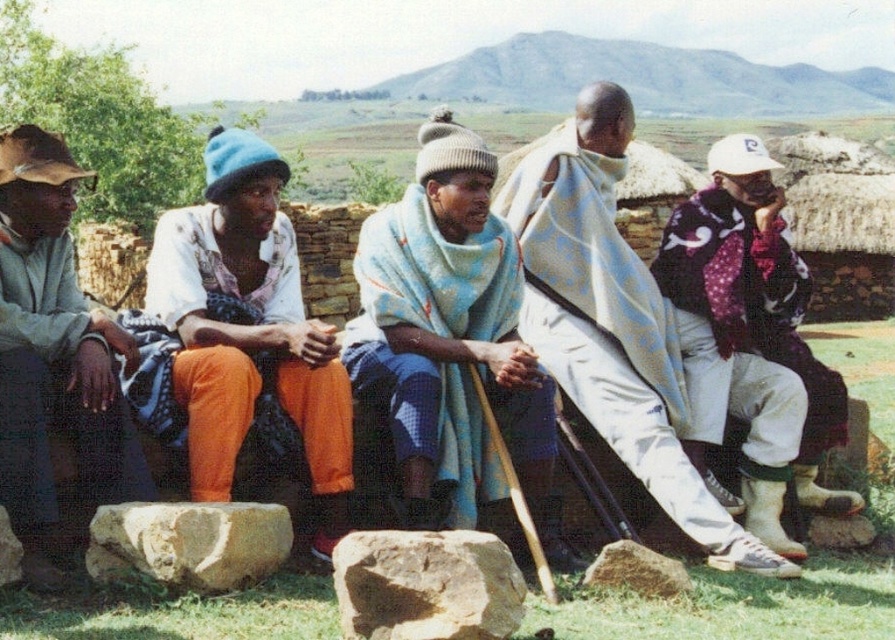
Is point (445, 547) closer to viewer compared to point (284, 554)?

Yes, point (445, 547) is in front of point (284, 554).

Does brown rough rock at lower center appear on the left side of smooth beige rock at lower left?

In fact, brown rough rock at lower center is to the right of smooth beige rock at lower left.

Between point (462, 605) and point (125, 522), which one is positioned in front?

Positioned in front is point (462, 605).

The height and width of the screenshot is (640, 895). I want to click on brown rough rock at lower center, so (x=425, y=586).

What do you see at coordinates (616, 324) in the screenshot? This screenshot has height=640, width=895. I see `white woven blanket at center` at bounding box center [616, 324].

Who is more distant from viewer, [531,228] or [182,506]?

Positioned behind is point [531,228].

What are the coordinates of `white woven blanket at center` in the screenshot? It's located at (616, 324).

Measure the distance from matte gray jacket at left to smooth beige rock at lower left.

matte gray jacket at left and smooth beige rock at lower left are 3.89 meters apart from each other.

Between matte gray jacket at left and smooth beige rock at lower left, which one has more height?

matte gray jacket at left

Which is in front, point (5, 148) or point (152, 579)?

Point (152, 579)

I want to click on matte gray jacket at left, so click(x=54, y=353).